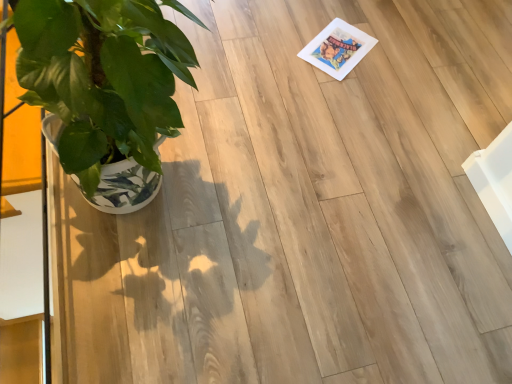
I want to click on free space in front of green glossy plant at left, so tap(154, 311).